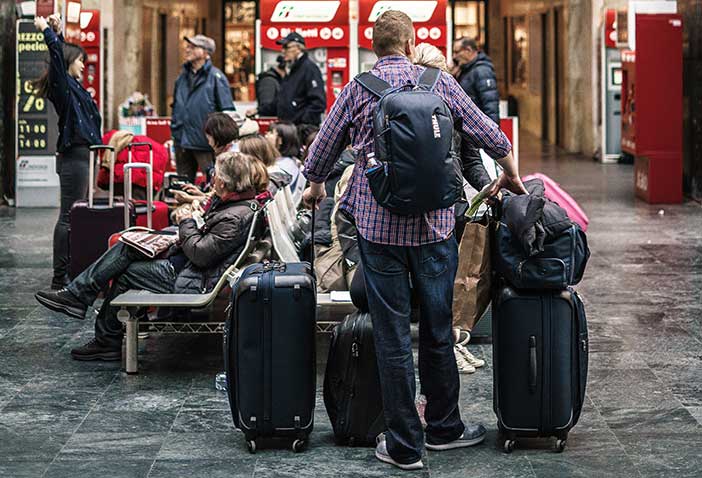
At what (x,y) coordinates should I click in order to perform the action: click on bench seat. Please return your answer as a coordinate pair (x, y). Looking at the image, I should click on (251, 234), (272, 230), (281, 205), (289, 193).